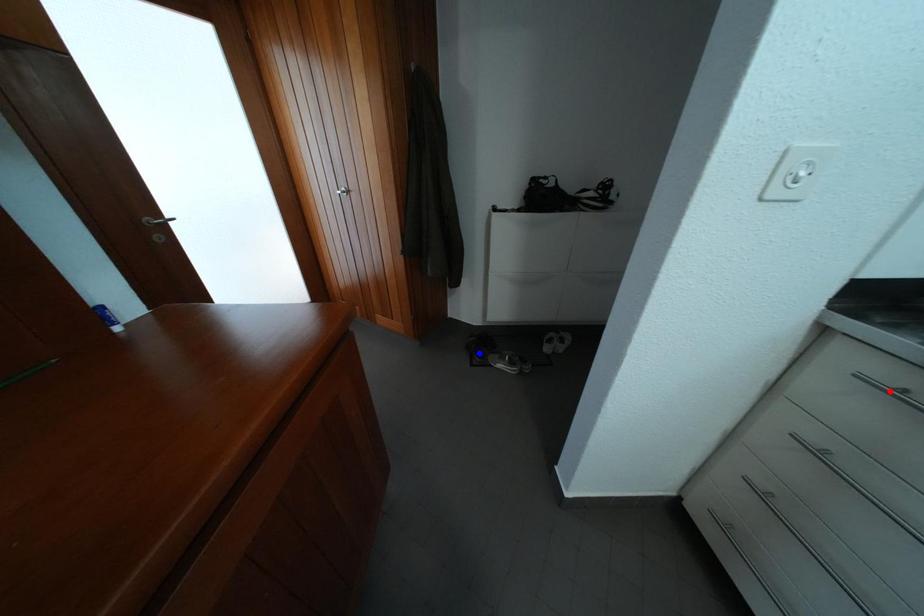
Question: Two points are marked on the image. Which point is closer to the camera?

Choices:
 (A) Blue point is closer.
 (B) Red point is closer.

Answer: (B)